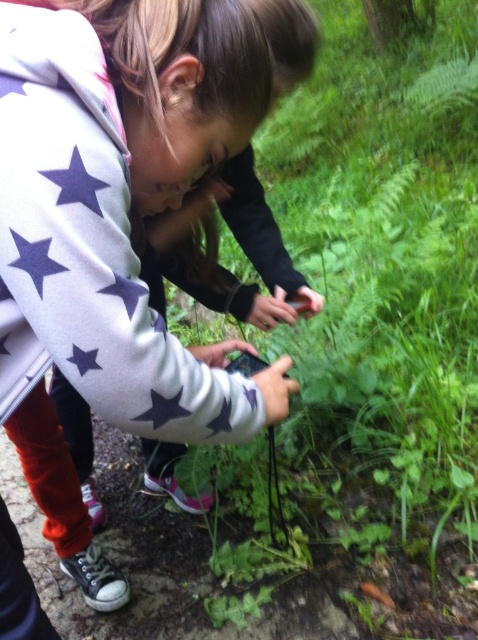
Does point (419, 291) come behind point (93, 392)?

Yes, it is.

Can you confirm if green leafy plant at center is positioned below white star-patterned hoodie at center?

Actually, green leafy plant at center is above white star-patterned hoodie at center.

Image resolution: width=478 pixels, height=640 pixels. What do you see at coordinates (366, 352) in the screenshot?
I see `green leafy plant at center` at bounding box center [366, 352].

You are a GUI agent. You are given a task and a screenshot of the screen. Output one action in this format:
    pyautogui.click(x=<x>, y=<y>)
    Task: Click on the green leafy plant at center
    The image size is (478, 640).
    Given the screenshot: What is the action you would take?
    [x=366, y=352]